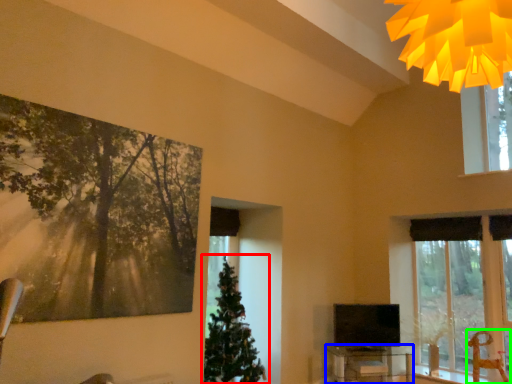
Question: Based on their relative distances, which object is farther from christmas tree (highlighted by a red box)? Choose from table (highlighted by a blue box) and swivel chair (highlighted by a green box).

Choices:
 (A) table
 (B) swivel chair

Answer: (B)